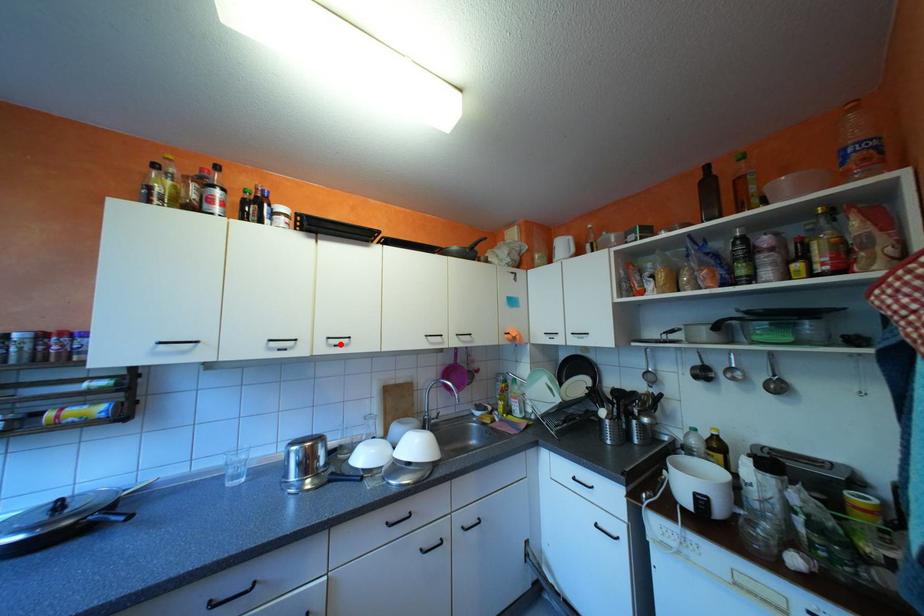
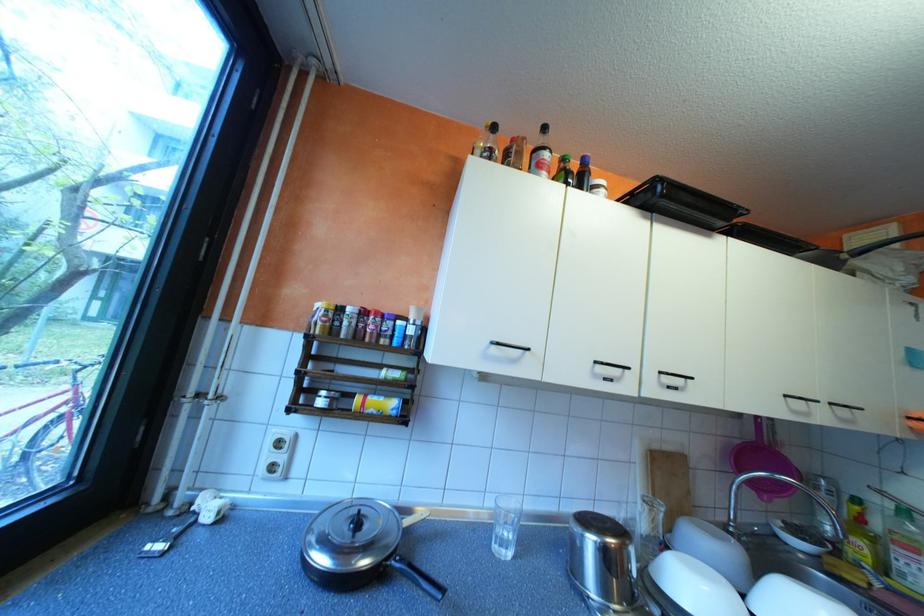
Where in the second image is the point corresponding to the highlighted location from the first image?

(673, 383)